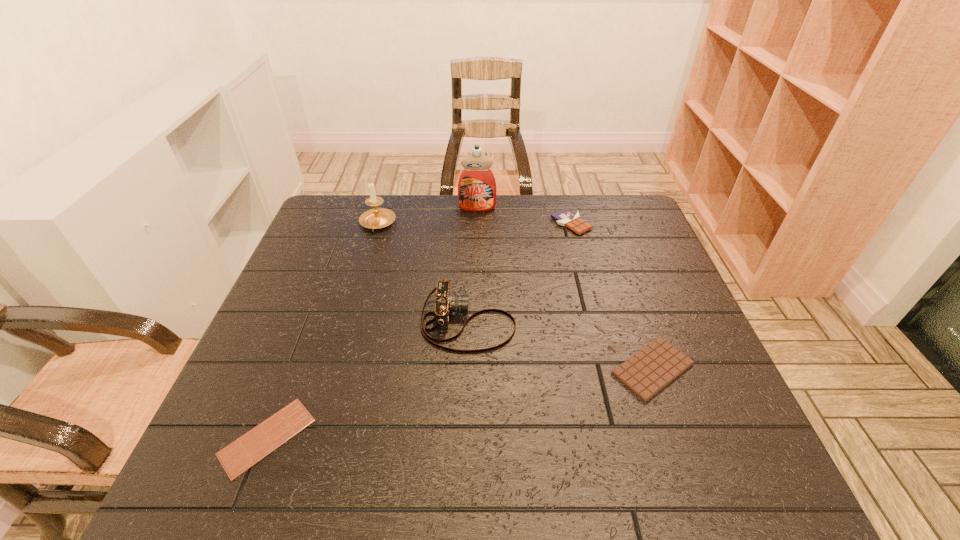
Where is `free spot located on the front-facing side of the fourth shortest object`? free spot located on the front-facing side of the fourth shortest object is located at coordinates (593, 322).

Identify the location of free space located on the front of the farthest chocolate bar. (588, 286).

This screenshot has width=960, height=540. Identify the location of free space located on the left of the second shortest chocolate bar. (564, 369).

The width and height of the screenshot is (960, 540). Find the location of `free spot located on the right of the leftmost chocolate bar`. free spot located on the right of the leftmost chocolate bar is located at coordinates (467, 437).

This screenshot has height=540, width=960. Find the location of `detergent situated at the far edge`. detergent situated at the far edge is located at coordinates (x=477, y=191).

Identify the location of candle holder positioned at the far edge. (376, 218).

Identify the location of chocolate bar that is at the far edge. The width and height of the screenshot is (960, 540). (564, 217).

Image resolution: width=960 pixels, height=540 pixels. I want to click on object positioned at the near edge, so click(x=243, y=453).

This screenshot has width=960, height=540. I want to click on candle holder present at the left edge, so click(376, 218).

Image resolution: width=960 pixels, height=540 pixels. In order to click on chocolate bar located in the left edge section of the desktop in this screenshot , I will do `click(243, 453)`.